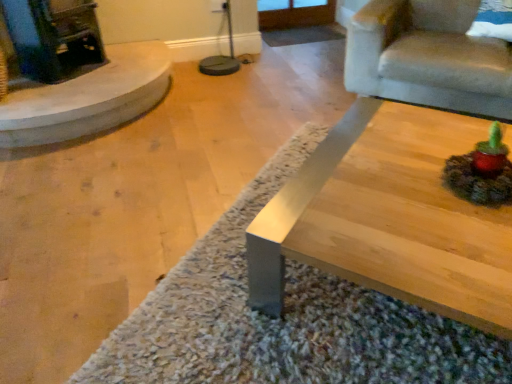
Find the location of a particular element. This screenshot has width=512, height=384. free point behind shaggy carpet at center is located at coordinates (258, 114).